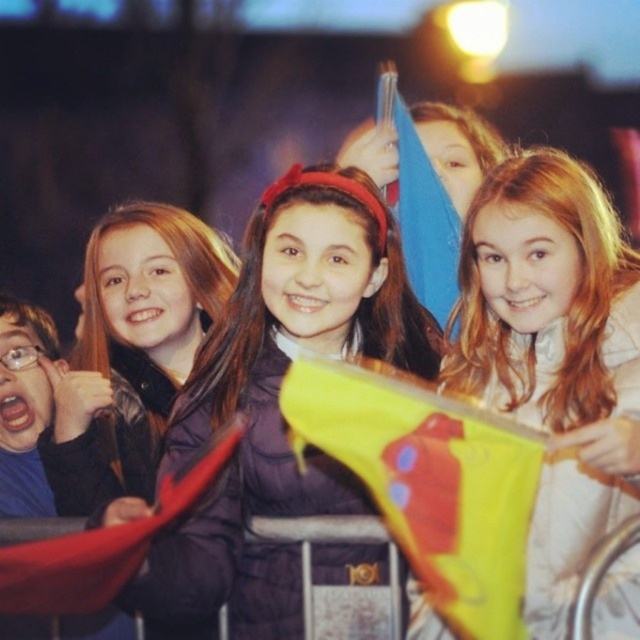
Is light brown hair at center thinner than matte black jacket at left?

Indeed, light brown hair at center has a lesser width compared to matte black jacket at left.

Between light brown hair at center and matte black jacket at left, which one has more height?

matte black jacket at left is taller.

Is point (468, 356) positioned before point (65, 468)?

Yes, point (468, 356) is closer to viewer.

In order to click on light brown hair at center in this screenshot , I will do [554, 355].

Is yellow fabric flag at center wider than matte red flag at lower left?

Yes.

Is yellow fabric flag at center above matte red flag at lower left?

Yes.

Describe the element at coordinates (429, 481) in the screenshot. I see `yellow fabric flag at center` at that location.

The image size is (640, 640). I want to click on yellow fabric flag at center, so click(429, 481).

Which is below, yellow fabric flag at center or blue fabric flag at upper center?

yellow fabric flag at center

Can you confirm if yellow fabric flag at center is thinner than blue fabric flag at upper center?

Incorrect, yellow fabric flag at center's width is not less than blue fabric flag at upper center's.

Is point (305, 429) farther from viewer compared to point (392, 118)?

No, (305, 429) is closer to viewer.

Locate an element on the screen. yellow fabric flag at center is located at coordinates (429, 481).